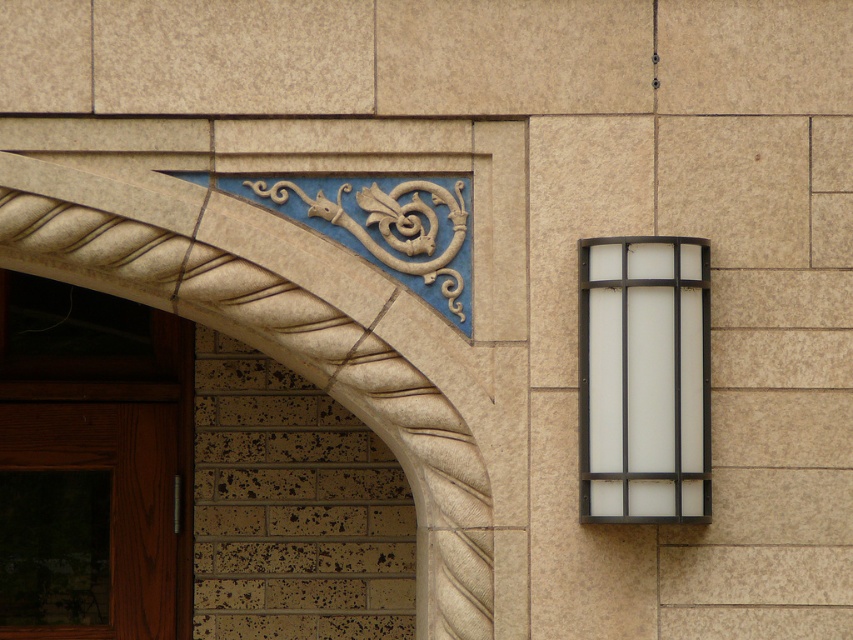
Question: Can you confirm if carved stone archway at upper left is positioned to the right of white frosted glass at right?

Choices:
 (A) yes
 (B) no

Answer: (B)

Question: Which point appears closest to the camera in this image?

Choices:
 (A) (387, 356)
 (B) (74, 580)
 (C) (660, 435)

Answer: (C)

Question: Considering the real-world distances, which object is closest to the white frosted glass at right?

Choices:
 (A) brown wooden door at lower left
 (B) carved stone archway at upper left

Answer: (B)

Question: Is brown wooden door at lower left positioned at the back of white frosted glass at right?

Choices:
 (A) yes
 (B) no

Answer: (A)

Question: Which of these objects is positioned closest to the white frosted glass at right?

Choices:
 (A) brown wooden door at lower left
 (B) carved stone archway at upper left

Answer: (B)

Question: Does brown wooden door at lower left appear on the left side of white frosted glass at right?

Choices:
 (A) yes
 (B) no

Answer: (A)